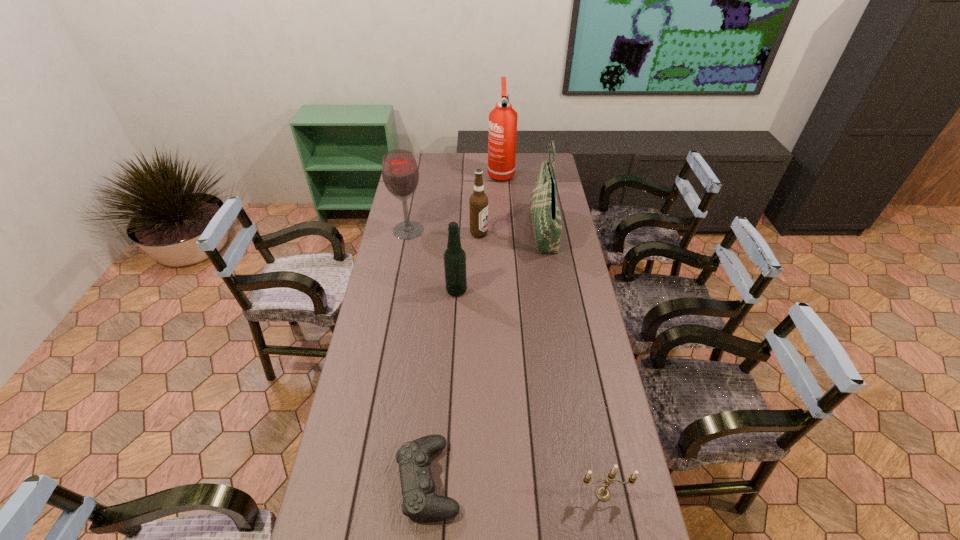
At what (x,y) coordinates should I click in order to perform the action: click on vacant area at the left edge. Please return your answer as a coordinate pair (x, y). Image resolution: width=960 pixels, height=540 pixels. Looking at the image, I should click on (379, 393).

The height and width of the screenshot is (540, 960). I want to click on free space at the right edge, so click(583, 273).

Where is `free space at the far left corner of the desktop`? Image resolution: width=960 pixels, height=540 pixels. free space at the far left corner of the desktop is located at coordinates (436, 156).

You are a GUI agent. You are given a task and a screenshot of the screen. Output one action in this format:
    pyautogui.click(x=<x>, y=<y>)
    Task: Click on the vacant area at the far right corner of the desktop
    The width and height of the screenshot is (960, 540).
    Given the screenshot: What is the action you would take?
    pyautogui.click(x=546, y=160)

Where is `empty space that is in between the leftmost alcohol and the nearest alcohol`? empty space that is in between the leftmost alcohol and the nearest alcohol is located at coordinates coord(432,260).

This screenshot has height=540, width=960. What are the coordinates of `vacant area that lies between the fifth farthest object and the tote bag` in the screenshot? It's located at (500, 261).

What are the coordinates of `empty location between the sixth tallest object and the tote bag` in the screenshot? It's located at (573, 363).

Where is `free space between the candle and the nearest alcohol`? The width and height of the screenshot is (960, 540). free space between the candle and the nearest alcohol is located at coordinates (530, 392).

You are a GUI agent. You are given a task and a screenshot of the screen. Output one action in this format:
    pyautogui.click(x=<x>, y=<y>)
    Task: Click on the free point between the candle and the fourth object from right to left
    
    Given the screenshot: What is the action you would take?
    pyautogui.click(x=541, y=363)

At what (x,y) coordinates should I click in order to perform the action: click on free space between the sixth tallest object and the rightmost alcohol. Please return your answer as a coordinate pair (x, y). Looking at the image, I should click on (541, 363).